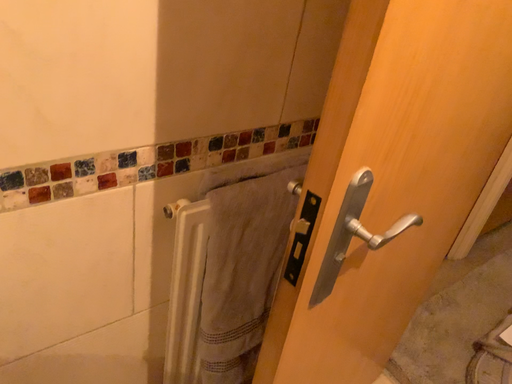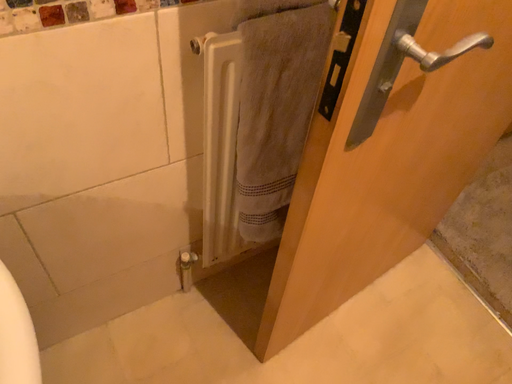
Question: Which way did the camera rotate in the video?

Choices:
 (A) rotated left
 (B) rotated right

Answer: (A)